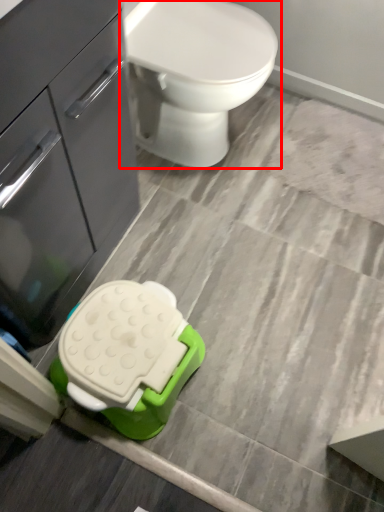
Question: From the image's perspective, what is the correct spatial relationship of toilet (annotated by the red box) in relation to bathroom cabinet?

Choices:
 (A) below
 (B) above

Answer: (B)